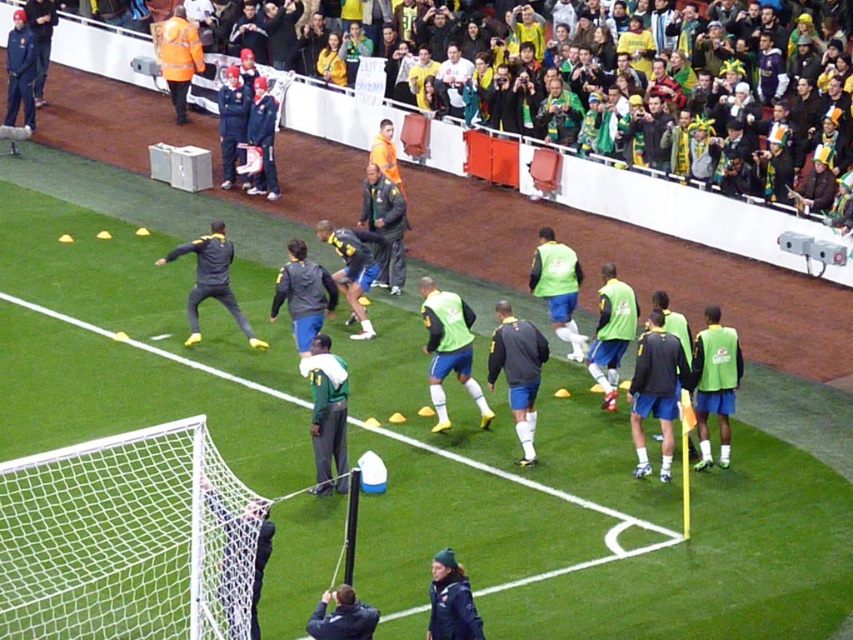
Question: Which object appears closest to the camera in this image?

Choices:
 (A) green jersey at center
 (B) dark green jersey at center

Answer: (A)

Question: Is green jersey at center further to the viewer compared to dark blue jacket at upper left?

Choices:
 (A) no
 (B) yes

Answer: (A)

Question: Can you confirm if dark green jersey at center is positioned to the right of dark blue jacket at upper left?

Choices:
 (A) no
 (B) yes

Answer: (B)

Question: Is white mesh net at lower left smaller than dark gray jacket at center?

Choices:
 (A) no
 (B) yes

Answer: (A)

Question: Which of the following is the closest to the observer?

Choices:
 (A) green jersey at center
 (B) dark gray jacket at center
 (C) white mesh net at lower left
 (D) dark blue jacket at upper left

Answer: (C)

Question: Which of the following is the closest to the observer?

Choices:
 (A) white mesh net at lower left
 (B) dark green jersey at center
 (C) dark gray jacket at center
 (D) dark blue jacket at upper left

Answer: (A)